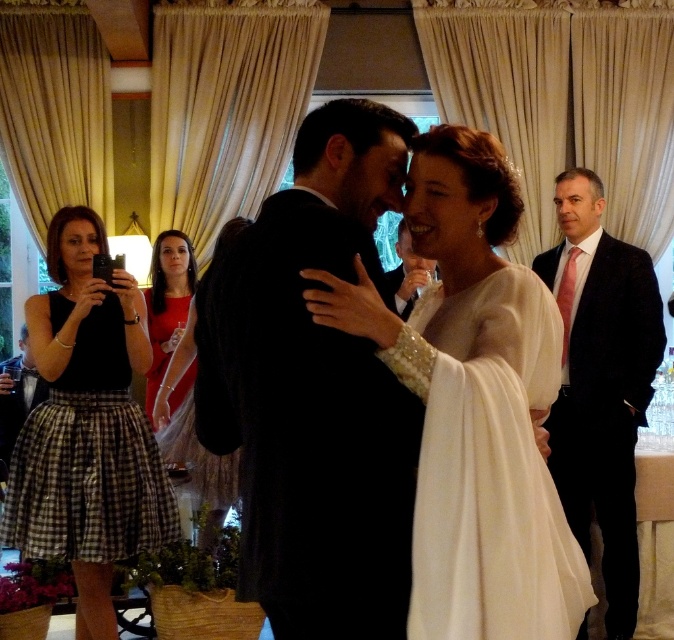
You are a photographer at the wedding reception and want to capture a photo of the white satin dress at center and the matte black suit at right. Which of the two should you focus on if you want to highlight the taller subject?

The matte black suit at right is taller than the white satin dress at center, so you should focus on the matte black suit at right to highlight the taller subject.

You are a photographer at the wedding reception. You need to capture a clear photo of both the white satin dress at center and the matte black suit at center. Based on their positions, which one might appear more prominent in the photo?

The white satin dress at center is in front of the matte black suit at center, so it will appear more prominent in the photo.

You are a photographer at a wedding reception. You need to capture a photo of the white satin dress at center and the matte black suit at right. Based on their positions, which one is on the left side?

The white satin dress at center is positioned on the left side of the matte black suit at right.